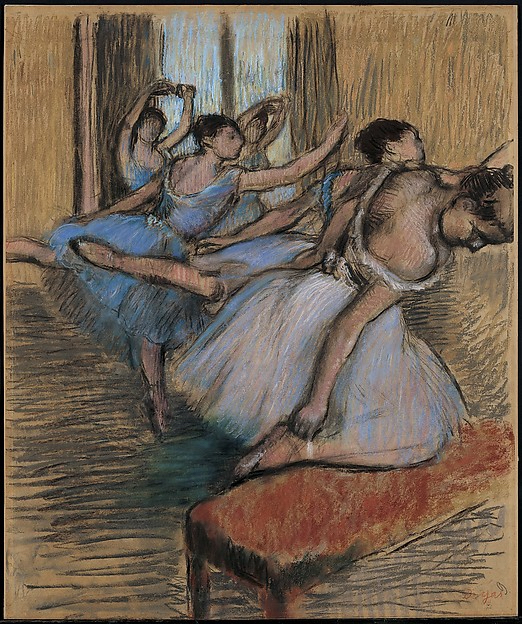
Image resolution: width=522 pixels, height=624 pixels. I want to click on curtains, so click(x=128, y=67), click(x=309, y=69).